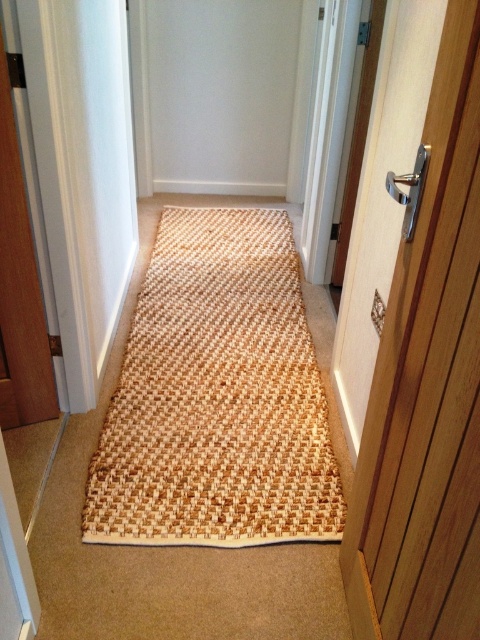
Between natural woven mat at center and wooden door at right, which one appears on the right side from the viewer's perspective?

wooden door at right

Is natural woven mat at center positioned at the back of wooden door at right?

Yes, natural woven mat at center is further from the viewer.

Locate an element on the screen. This screenshot has width=480, height=640. natural woven mat at center is located at coordinates (x=216, y=396).